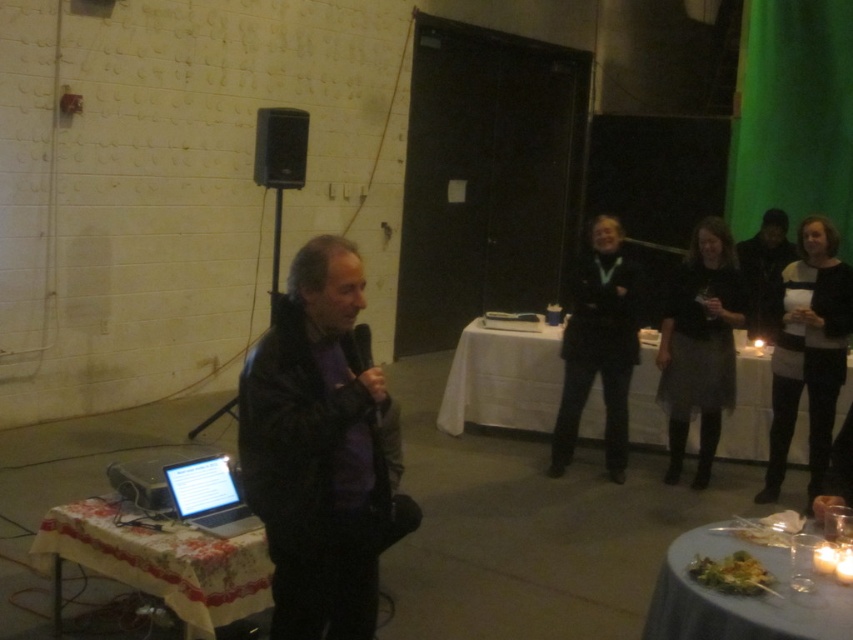
Question: Can you confirm if black knitwear at center is smaller than black matte microphone at center?

Choices:
 (A) no
 (B) yes

Answer: (A)

Question: Which object appears closest to the camera in this image?

Choices:
 (A) white cloth table at center
 (B) white glossy plate at lower right
 (C) silver metallic laptop at lower left
 (D) black knitwear at center

Answer: (B)

Question: Which object appears farthest from the camera in this image?

Choices:
 (A) black matte speaker at upper center
 (B) dark brown leather jacket at right
 (C) white lace tablecloth at lower left

Answer: (A)

Question: Can you confirm if black leather jacket at center is positioned below black matte speaker at upper center?

Choices:
 (A) yes
 (B) no

Answer: (A)

Question: In this image, where is white cloth table at center located relative to black matte speaker at upper center?

Choices:
 (A) right
 (B) left

Answer: (A)

Question: Which point appears farthest from the camera in this image?

Choices:
 (A) (367, 346)
 (B) (598, 392)
 (C) (241, 561)

Answer: (B)